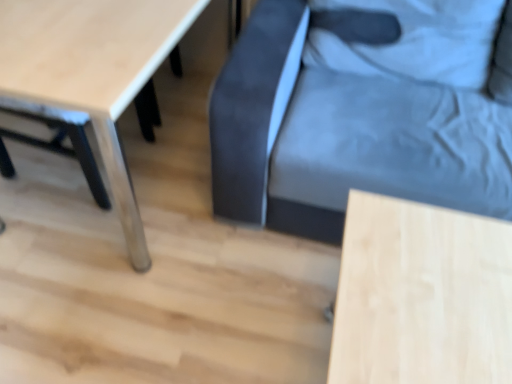
You are a GUI agent. You are given a task and a screenshot of the screen. Output one action in this format:
    pyautogui.click(x=<x>, y=<y>)
    Task: Click on the vacant space underneath light wood table at lower left, arranged as the second table when viewed from the right (from a real-world perspective)
    The width and height of the screenshot is (512, 384).
    Given the screenshot: What is the action you would take?
    pyautogui.click(x=103, y=192)